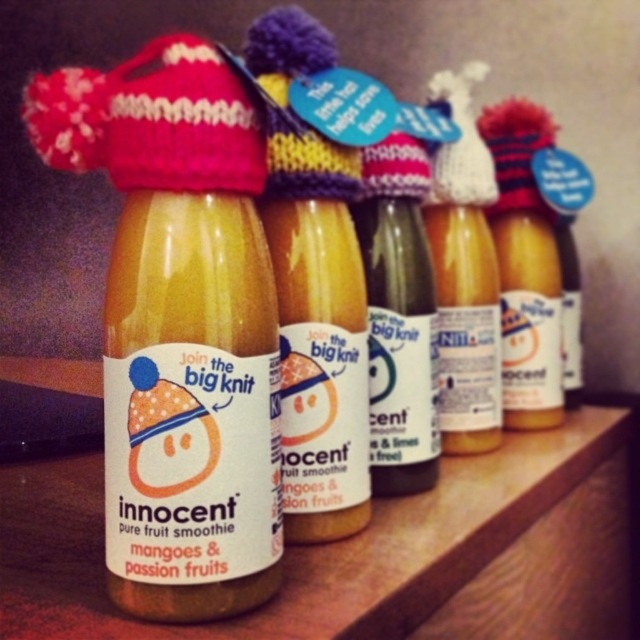
Who is higher up, translucent glass bottle at center or matte glass bottle at center?

matte glass bottle at center is above.

Describe the element at coordinates (189, 275) in the screenshot. I see `translucent glass bottle at center` at that location.

Who is more forward, (161, 227) or (397, 272)?

Point (161, 227) is in front.

Locate an element on the screen. The image size is (640, 640). translucent glass bottle at center is located at coordinates (189, 275).